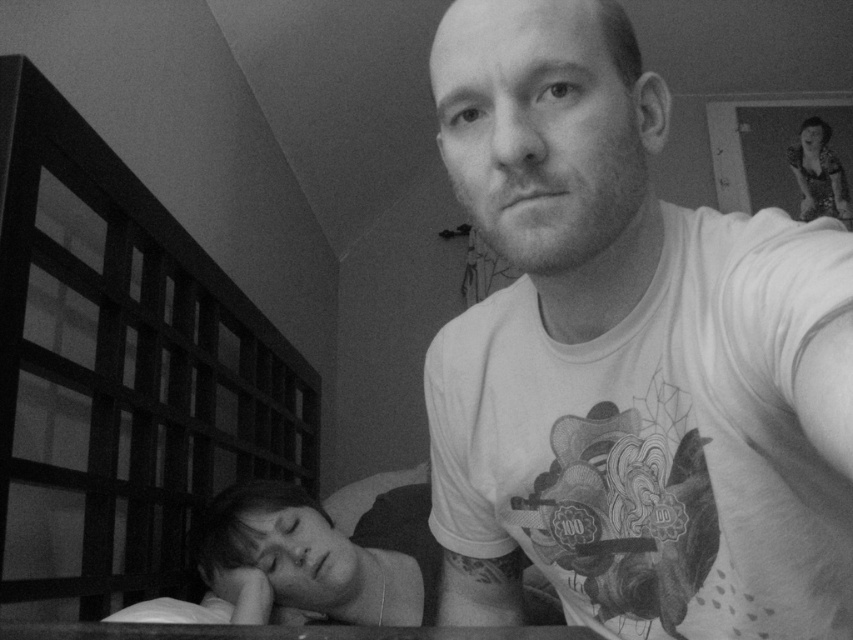
Question: Is white cotton t-shirt at upper right above shiny black dress at upper right?

Choices:
 (A) no
 (B) yes

Answer: (A)

Question: Is white cotton t-shirt at upper right bigger than shiny black dress at upper right?

Choices:
 (A) yes
 (B) no

Answer: (A)

Question: Which point is closer to the camera?

Choices:
 (A) white cotton t-shirt at upper right
 (B) shiny black dress at upper right

Answer: (A)

Question: Among these objects, which one is nearest to the camera?

Choices:
 (A) white cotton t-shirt at upper right
 (B) shiny black dress at upper right

Answer: (A)

Question: From the image, what is the correct spatial relationship of white cotton t-shirt at upper right in relation to shiny black dress at upper right?

Choices:
 (A) right
 (B) left

Answer: (B)

Question: Which of the following is the closest to the observer?

Choices:
 (A) (822, 212)
 (B) (519, 138)

Answer: (B)